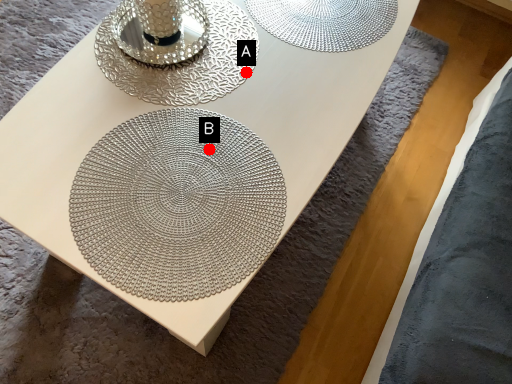
Question: Two points are circled on the image, labeled by A and B beside each circle. Which point is closer to the camera?

Choices:
 (A) A is closer
 (B) B is closer

Answer: (B)